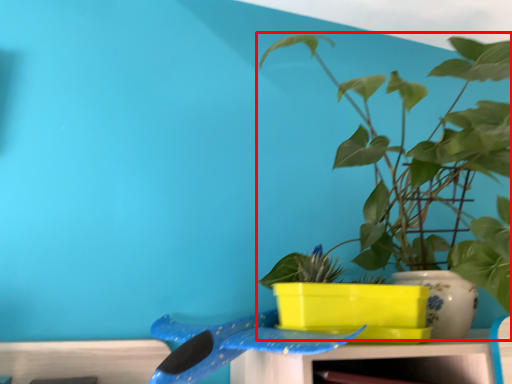
Question: Where is houseplant (annotated by the red box) located in relation to whale in the image?

Choices:
 (A) right
 (B) left

Answer: (A)